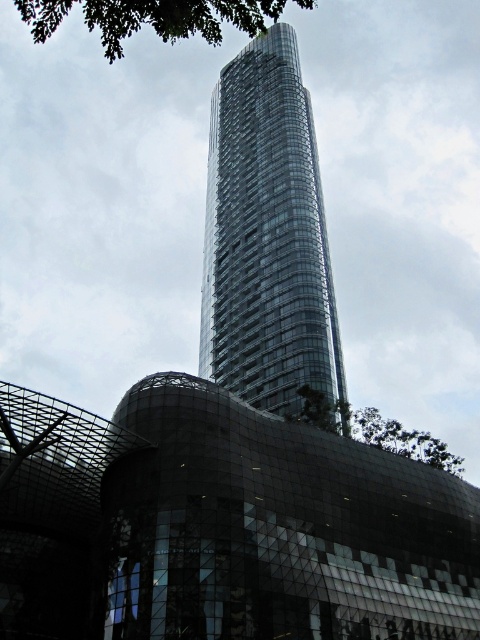
You are an architect evaluating the placement of two green leafy trees in the image. The trees are labeled as the green leafy tree at upper left and the green leafy tree at upper center. Based on their sizes, which tree would cast a longer shadow during midday when the sun is directly overhead?

The green leafy tree at upper left has a larger size compared to the green leafy tree at upper center, so it would cast a longer shadow during midday when the sun is directly overhead.

Looking at the modern architectural scene, which object would cast a longer shadow during midday? The transparent glass tower at center or the green leafy tree at upper center?

The transparent glass tower at center is much taller than the green leafy tree at upper center, so it would cast a longer shadow during midday.

You are standing in the middle of the street looking at the transparent glass tower at center and the green leafy tree at upper left. Which object would appear closer to you?

The transparent glass tower at center appears closer to you because it is further to the viewer than the green leafy tree at upper left.